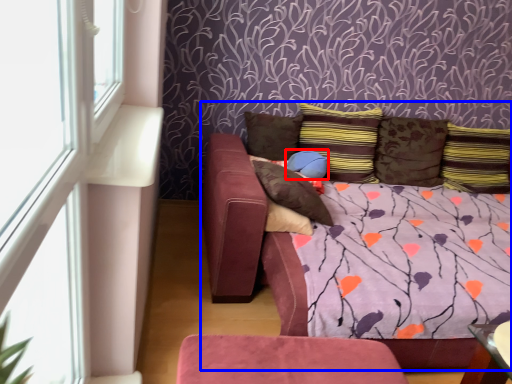
Question: Which object appears closest to the camera in this image, pillow (highlighted by a red box) or studio couch (highlighted by a blue box)?

Choices:
 (A) pillow
 (B) studio couch

Answer: (B)